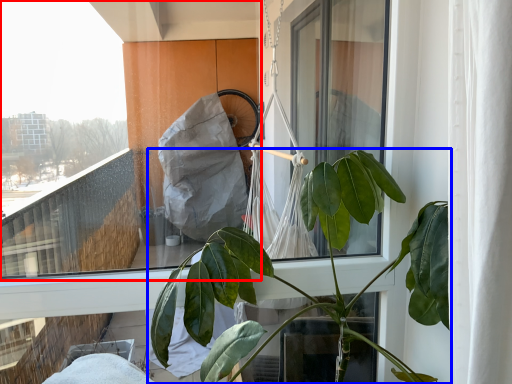
Question: Which point is further to the camera, window (highlighted by a red box) or houseplant (highlighted by a blue box)?

Choices:
 (A) window
 (B) houseplant

Answer: (A)